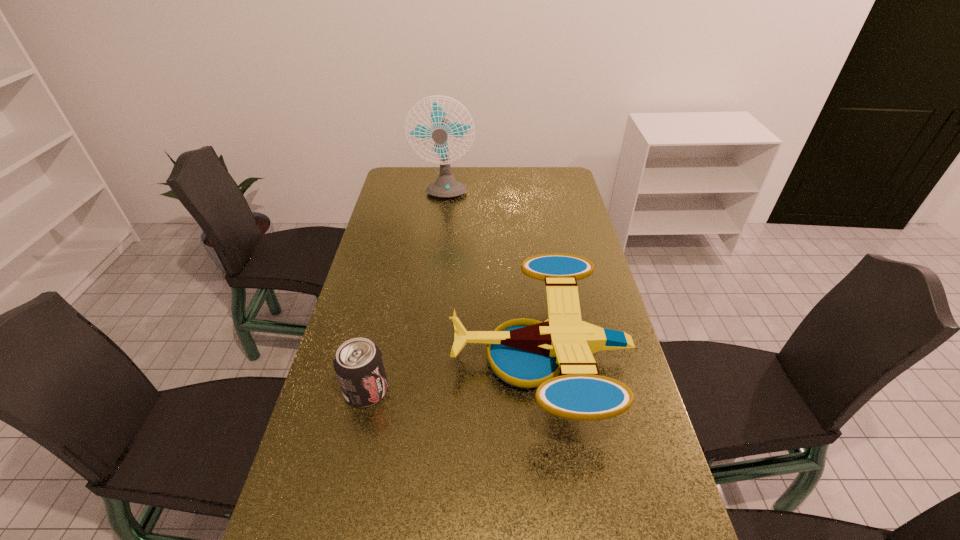
Find the location of a particular element. The width and height of the screenshot is (960, 540). fan that is at the left edge is located at coordinates (446, 186).

Where is `soda can located in the left edge section of the desktop`? The height and width of the screenshot is (540, 960). soda can located in the left edge section of the desktop is located at coordinates (358, 363).

Locate an element on the screen. This screenshot has width=960, height=540. object present at the right edge is located at coordinates (526, 353).

At what (x,y) coordinates should I click in order to perform the action: click on object that is at the far left corner. Please return your answer as a coordinate pair (x, y). The width and height of the screenshot is (960, 540). Looking at the image, I should click on (446, 186).

Image resolution: width=960 pixels, height=540 pixels. I want to click on free space at the left edge of the desktop, so click(x=381, y=261).

Identify the location of vacant space at the right edge of the desktop. (599, 355).

The image size is (960, 540). In the image, there is a desktop. In order to click on blank space at the far right corner in this screenshot , I will do `click(557, 171)`.

Find the location of `free space between the fan and the drone`. free space between the fan and the drone is located at coordinates pos(492,277).

Identify the location of vacant region between the farthest object and the soda can. (405, 293).

Locate an element on the screen. This screenshot has width=960, height=540. free spot between the drone and the fan is located at coordinates (492, 277).